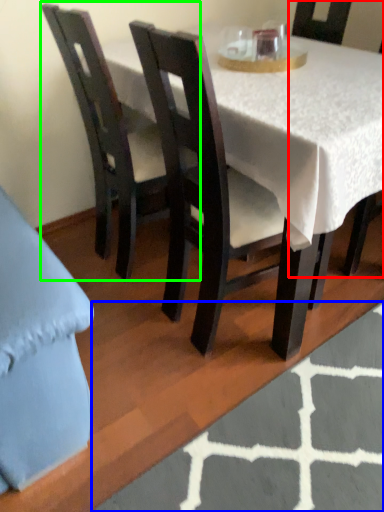
Question: Estimate the real-world distances between objects in this image. Which object is farther from chair (highlighted by a red box), place mat (highlighted by a blue box) or chair (highlighted by a green box)?

Choices:
 (A) place mat
 (B) chair

Answer: (A)